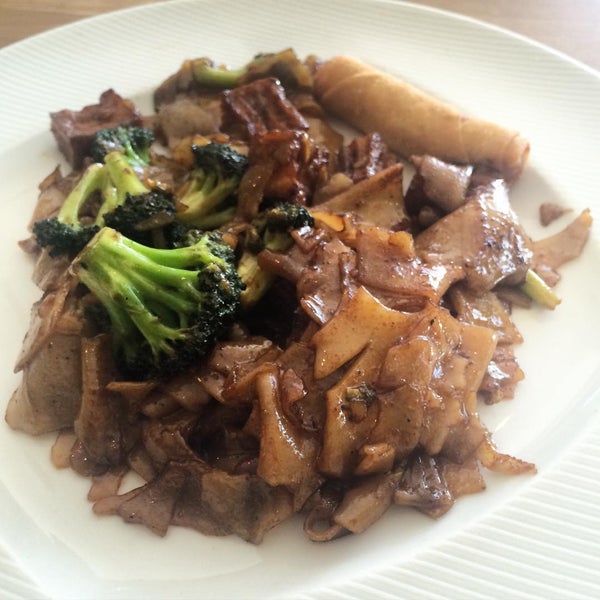
Locate an element on the screen. rim of plate is located at coordinates (35, 35), (118, 10), (419, 8), (528, 42), (593, 71).